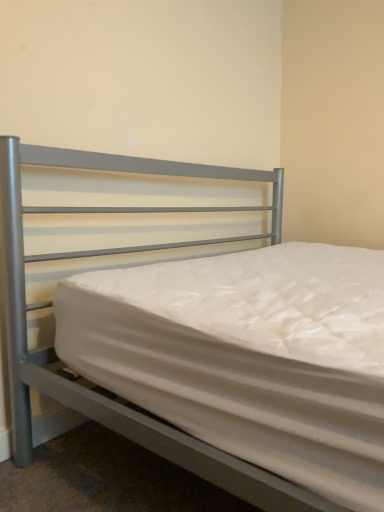
Identify the location of metallic gray bed at center. (99, 386).

Image resolution: width=384 pixels, height=512 pixels. What do you see at coordinates (99, 386) in the screenshot?
I see `metallic gray bed at center` at bounding box center [99, 386].

Where is `metallic gray bed at center`? The image size is (384, 512). metallic gray bed at center is located at coordinates (99, 386).